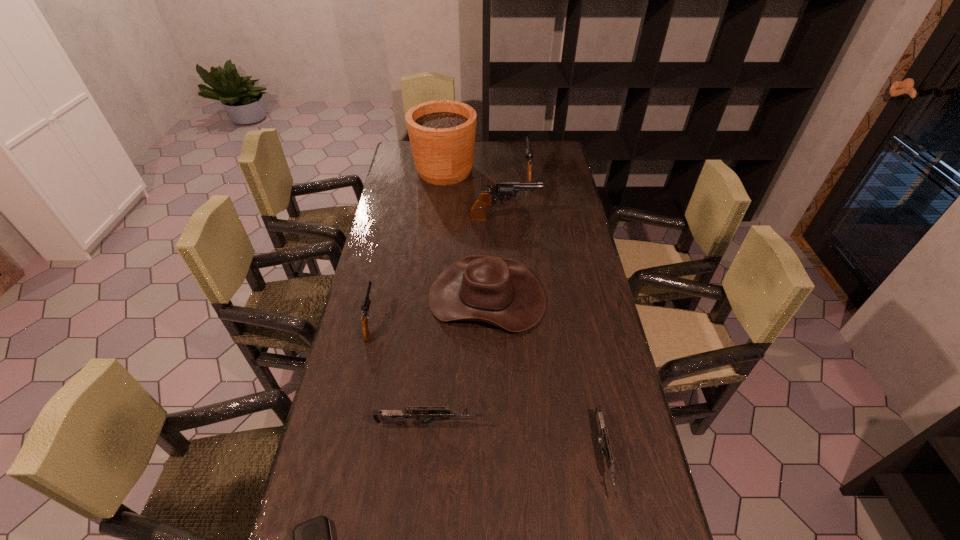
You are a GUI agent. You are given a task and a screenshot of the screen. Output one action in this format:
    pyautogui.click(x=<x>, y=<y>)
    Task: Click on the second closest black gun relative to the cowboy hat
    The height and width of the screenshot is (540, 960).
    Given the screenshot: What is the action you would take?
    pyautogui.click(x=505, y=191)

Find the location of a particular element. The image size is (960, 540). black gun that stands as the closest to the flowerpot is located at coordinates (505, 191).

Select which grey gun is the second closest to the farthest gun. Please provide its 2D coordinates. Your answer should be formatted as a tuple, i.e. [(x, y)], where the tuple contains the x and y coordinates of a point satisfying the conditions above.

[(420, 413)]

Image resolution: width=960 pixels, height=540 pixels. Identify the location of grey gun identified as the second closest to the cowboy hat. (420, 413).

I want to click on free space that satisfies the following two spatial constraints: 1. along the barrel of the leftmost black gun; 2. on the right side of the cowboy hat, so click(x=376, y=298).

Find the location of `free point that satisfies the following two spatial constraints: 1. along the barrel of the third tallest gun; 2. on the right side of the cowboy hat`. free point that satisfies the following two spatial constraints: 1. along the barrel of the third tallest gun; 2. on the right side of the cowboy hat is located at coordinates (376, 298).

Find the location of a particular element. Image resolution: width=960 pixels, height=540 pixels. free space that satisfies the following two spatial constraints: 1. along the barrel of the flowerpot; 2. on the left side of the fourth shortest object is located at coordinates (404, 171).